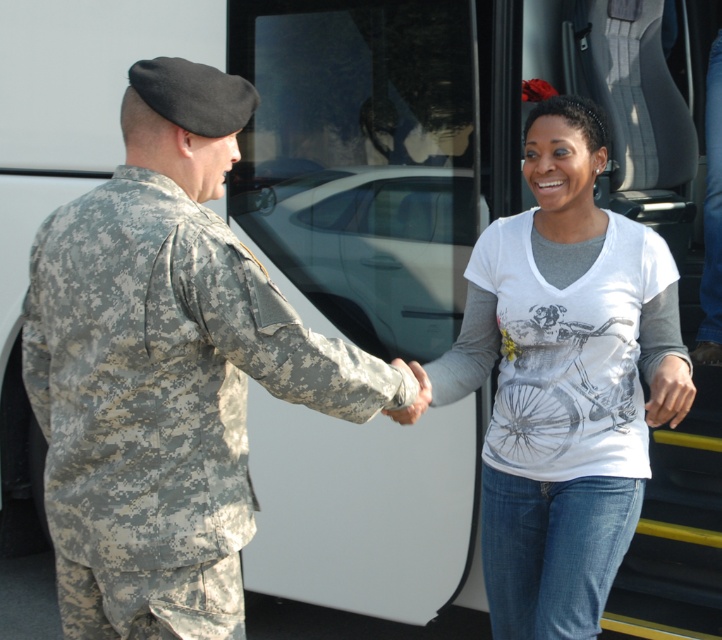
Can you confirm if camouflage uniform at left is positioned to the left of white printed shirt at center?

Indeed, camouflage uniform at left is positioned on the left side of white printed shirt at center.

What do you see at coordinates (165, 369) in the screenshot? I see `camouflage uniform at left` at bounding box center [165, 369].

Who is more distant from viewer, (103, 477) or (591, 227)?

The point (591, 227) is more distant.

You are a GUI agent. You are given a task and a screenshot of the screen. Output one action in this format:
    pyautogui.click(x=<x>, y=<y>)
    Task: Click on the camouflage uniform at left
    
    Given the screenshot: What is the action you would take?
    pyautogui.click(x=165, y=369)